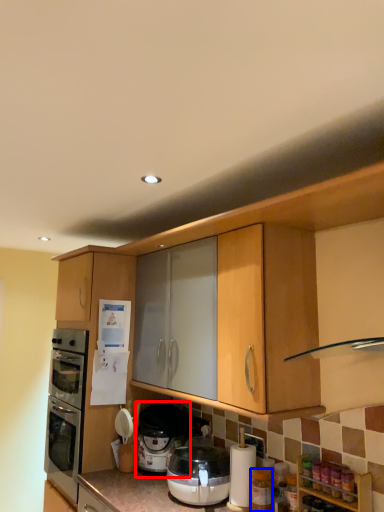
Question: Among these objects, which one is nearest to the camera, pressure cooker (highlighted by a red box) or bottle (highlighted by a blue box)?

Choices:
 (A) pressure cooker
 (B) bottle

Answer: (B)